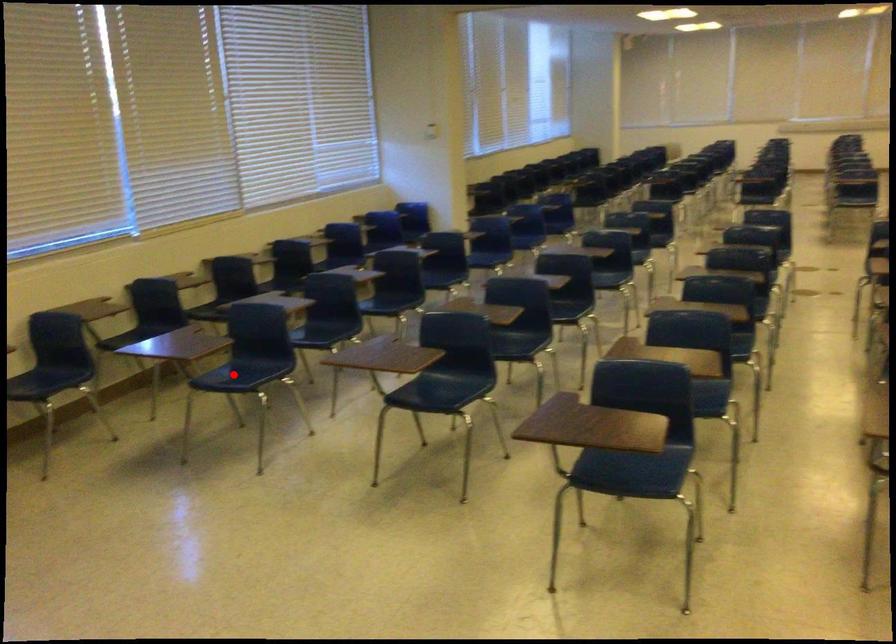
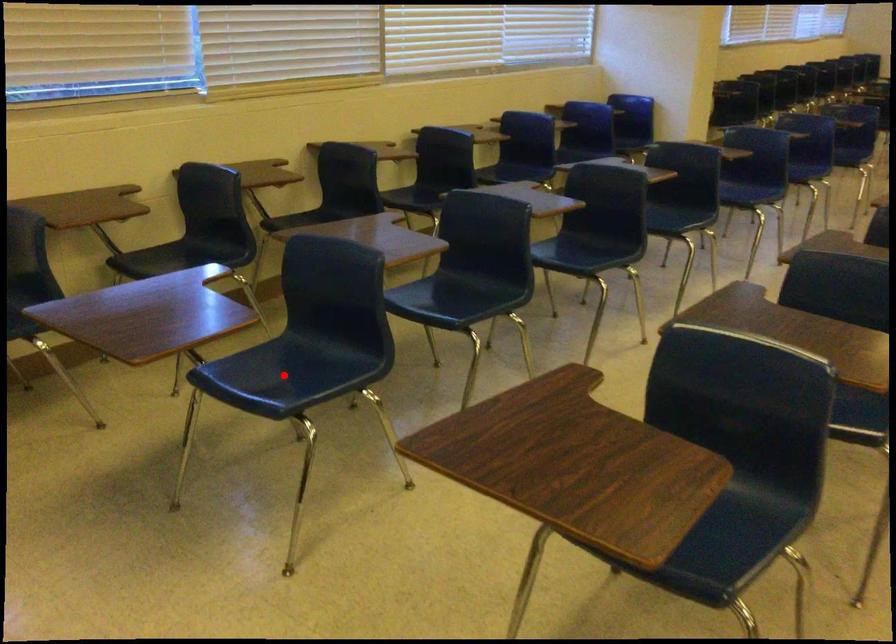
In the scene shown: I am providing you with two images of the same scene from different viewpoints. A red point is marked on the first image and another point is marked on the second image. Is the marked point in image1 the same physical position as the marked point in image2?

Yes